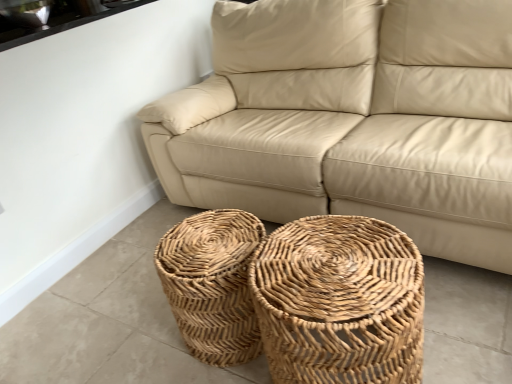
Question: Is natural woven baskets at center, the 2th basket in the right-to-left sequence, placed right next to white glossy window sill at upper left?

Choices:
 (A) yes
 (B) no

Answer: (B)

Question: Is natural woven baskets at center, the 2th basket in the right-to-left sequence, completely or partially outside of white glossy window sill at upper left?

Choices:
 (A) no
 (B) yes

Answer: (B)

Question: Considering the relative positions of natural woven baskets at center, the 2th basket in the right-to-left sequence, and white glossy window sill at upper left in the image provided, is natural woven baskets at center, the 2th basket in the right-to-left sequence, to the right of white glossy window sill at upper left from the viewer's perspective?

Choices:
 (A) yes
 (B) no

Answer: (A)

Question: From the image's perspective, would you say natural woven baskets at center, the 2th basket in the right-to-left sequence, is positioned over white glossy window sill at upper left?

Choices:
 (A) no
 (B) yes

Answer: (A)

Question: Does natural woven baskets at center, the 2th basket in the right-to-left sequence, have a lesser height compared to white glossy window sill at upper left?

Choices:
 (A) yes
 (B) no

Answer: (B)

Question: Is natural woven baskets at center, which is counted as the first basket, starting from the left, facing away from white glossy window sill at upper left?

Choices:
 (A) yes
 (B) no

Answer: (B)

Question: Does natural woven basket at center, positioned as the 2th basket in left-to-right order, have a smaller size compared to natural woven baskets at center, which is counted as the first basket, starting from the left?

Choices:
 (A) no
 (B) yes

Answer: (A)

Question: Does natural woven basket at center, positioned as the 2th basket in left-to-right order, have a greater width compared to natural woven baskets at center, the 2th basket in the right-to-left sequence?

Choices:
 (A) yes
 (B) no

Answer: (A)

Question: Is natural woven basket at center, the 1th basket viewed from the right, shorter than natural woven baskets at center, the 2th basket in the right-to-left sequence?

Choices:
 (A) no
 (B) yes

Answer: (A)

Question: Is natural woven basket at center, the 1th basket viewed from the right, bigger than natural woven baskets at center, the 2th basket in the right-to-left sequence?

Choices:
 (A) yes
 (B) no

Answer: (A)

Question: Is natural woven basket at center, positioned as the 2th basket in left-to-right order, to the left of natural woven baskets at center, the 2th basket in the right-to-left sequence, from the viewer's perspective?

Choices:
 (A) yes
 (B) no

Answer: (B)

Question: Can we say natural woven basket at center, positioned as the 2th basket in left-to-right order, lies outside natural woven baskets at center, which is counted as the first basket, starting from the left?

Choices:
 (A) yes
 (B) no

Answer: (A)

Question: Is beige leather couch at center next to white glossy window sill at upper left and touching it?

Choices:
 (A) yes
 (B) no

Answer: (B)